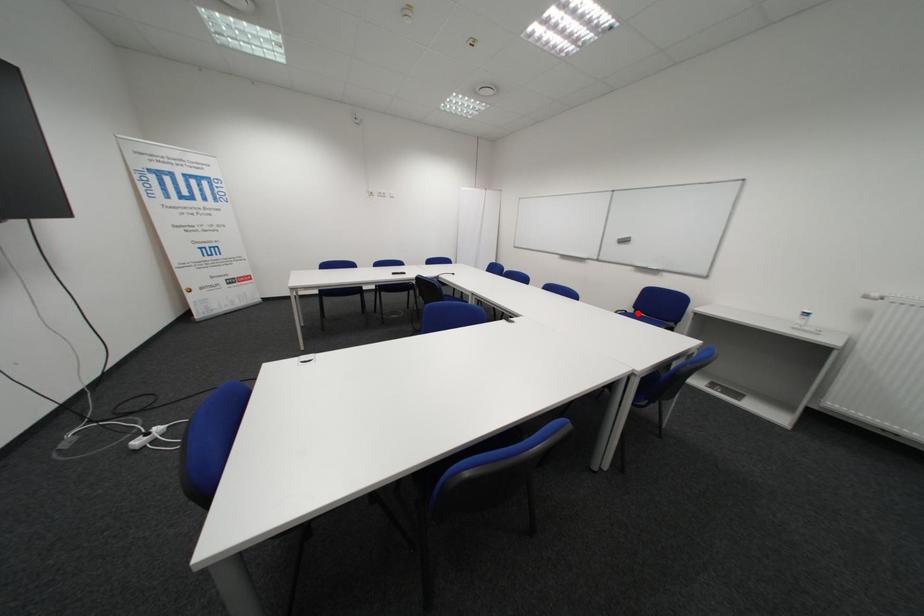
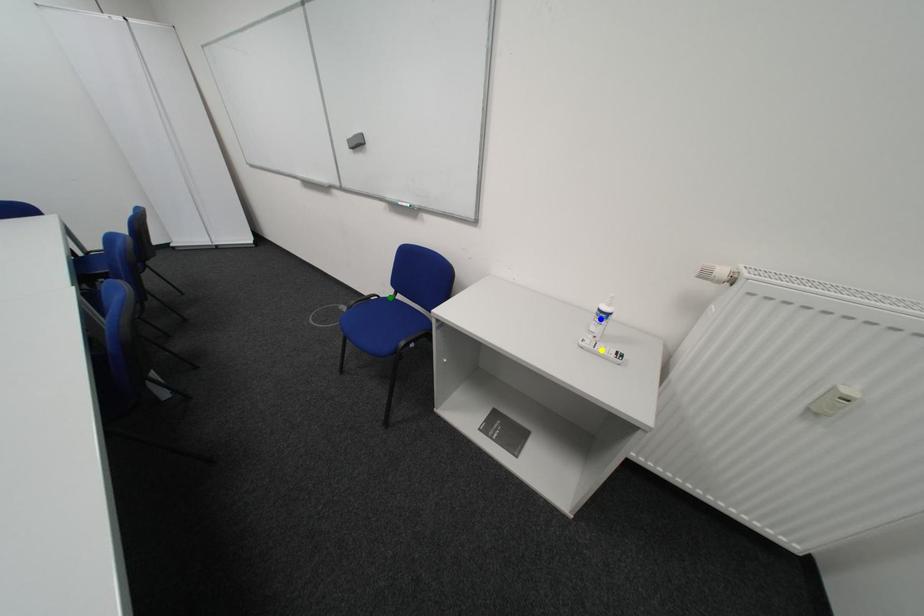
Question: I am providing you with two images of the same scene from different viewpoints. A red point is marked on the first image. You are given multiple points on the second image. Can you choose the point in image 2 that corresponds to the point in image 1?

Choices:
 (A) green point
 (B) blue point
 (C) yellow point

Answer: (A)